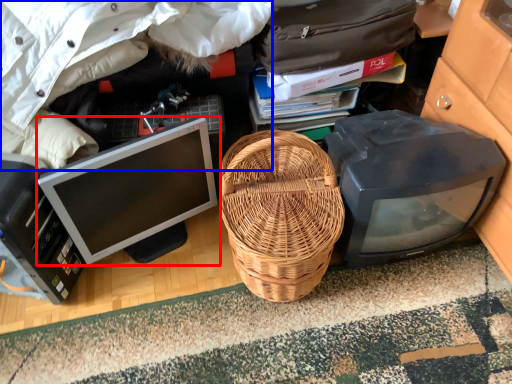
Question: Which point is closer to the camera, computer monitor (highlighted by a red box) or clothing (highlighted by a blue box)?

Choices:
 (A) computer monitor
 (B) clothing

Answer: (B)